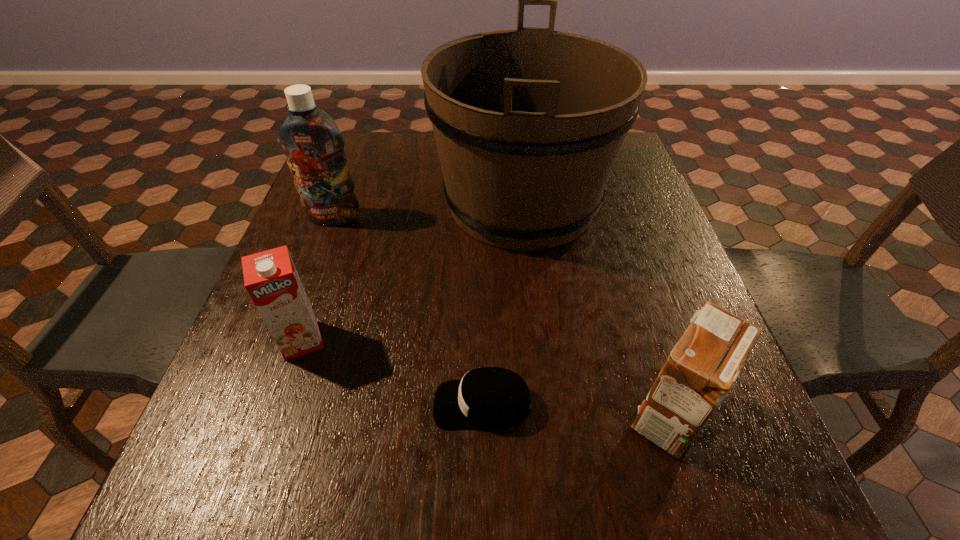
Where is `the tallest object`? The width and height of the screenshot is (960, 540). the tallest object is located at coordinates (528, 123).

Identify the location of shampoo. The image size is (960, 540). (313, 144).

You are a GUI agent. You are given a task and a screenshot of the screen. Output one action in this format:
    pyautogui.click(x=<x>, y=<y>)
    Task: Click on the right carton
    Image resolution: width=960 pixels, height=540 pixels.
    Given the screenshot: What is the action you would take?
    pyautogui.click(x=701, y=369)

The height and width of the screenshot is (540, 960). In order to click on the third farthest object in this screenshot , I will do `click(270, 277)`.

Image resolution: width=960 pixels, height=540 pixels. I want to click on the farther carton, so click(x=270, y=277).

Find the location of `the shortest object`. the shortest object is located at coordinates (x=489, y=397).

At what (x,y) coordinates should I click in order to perform the action: click on free spot located on the back of the tallest object. Please return your answer as a coordinate pair (x, y). Looking at the image, I should click on (515, 142).

Identify the location of vacant point located 0.120m on the front label of the shampoo. (318, 261).

This screenshot has width=960, height=540. What are the coordinates of `free space located on the straw side of the nearer carton` in the screenshot? It's located at (524, 416).

Where is `free region located 0.370m on the straw side of the nearer carton`? free region located 0.370m on the straw side of the nearer carton is located at coordinates (402, 416).